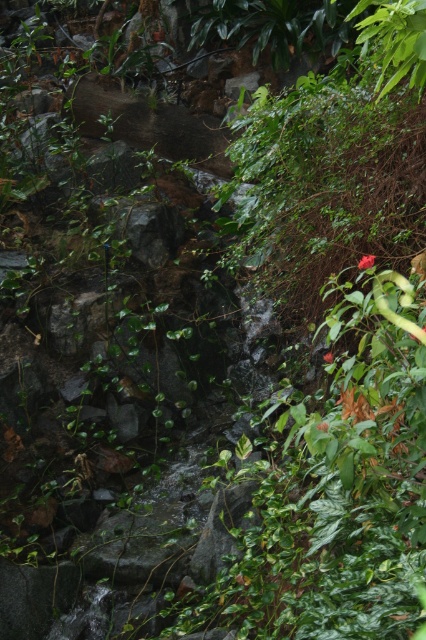
You are a gardener who wants to plant a new flower between the green matte flower at center and the red matte flower at center right. Based on their current positions, which flower should you place the new flower closer to?

The green matte flower at center is positioned on the left side of the red matte flower at center right, so you should place the new flower closer to the red matte flower at center right to maintain symmetry.

You are a gardener who wants to place a new statue between the green matte flower at center and the red matte flower at center right. Which flower should you position the statue closer to so it appears centered between them?

The green matte flower at center is in front of the red matte flower at center right. To center the statue between them, place it closer to the green matte flower at center since it is nearer to the viewer.

You are a botanist examining the garden scene. You notice two flowers in the image. The green matte flower at center and the red matte flower at center right. Which one has a larger size?

The green matte flower at center is bigger than the red matte flower at center right.